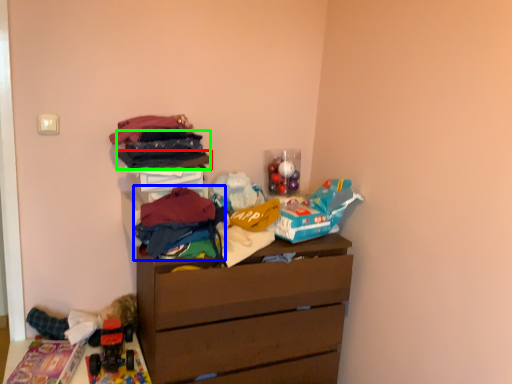
Question: Which object is positioned farthest from clothing (highlighted by a red box)? Select from clothing (highlighted by a blue box) and clothing (highlighted by a green box).

Choices:
 (A) clothing
 (B) clothing

Answer: (A)